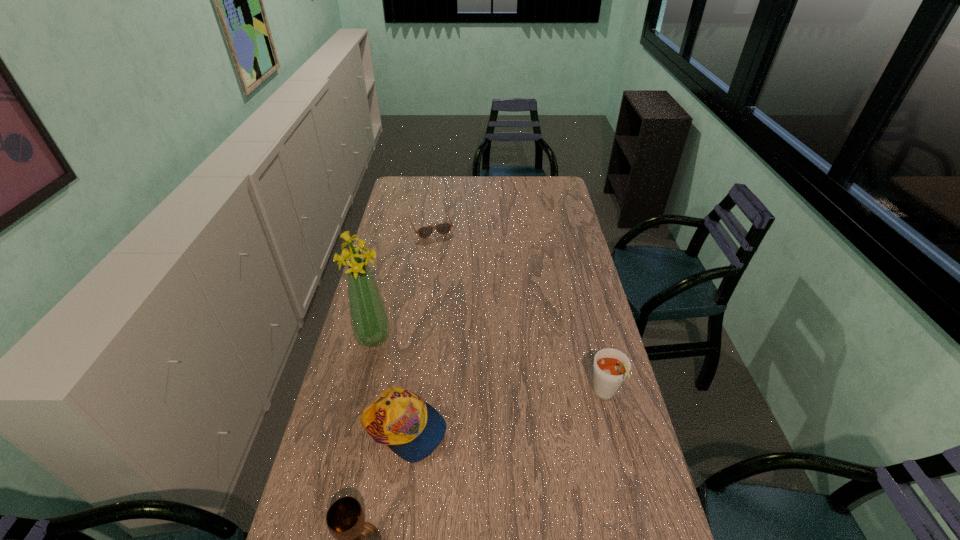
Identify the location of empty location between the bouquet and the cap. (389, 383).

Where is `free spot between the farthest object and the tallest object`? This screenshot has width=960, height=540. free spot between the farthest object and the tallest object is located at coordinates (402, 282).

Where is `object that ranks as the third closest to the sunglasses`? object that ranks as the third closest to the sunglasses is located at coordinates (611, 366).

Where is `object that is the closest to the cap`? The width and height of the screenshot is (960, 540). object that is the closest to the cap is located at coordinates (345, 518).

In order to click on free space that satisfies the following two spatial constraints: 1. on the back side of the tallest object; 2. on the right side of the sunglasses in this screenshot , I will do `click(400, 226)`.